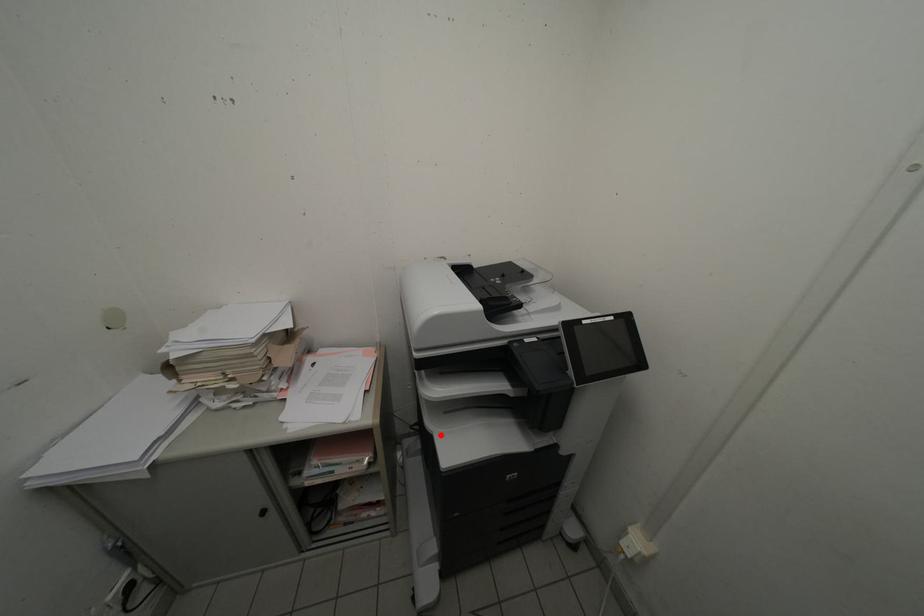
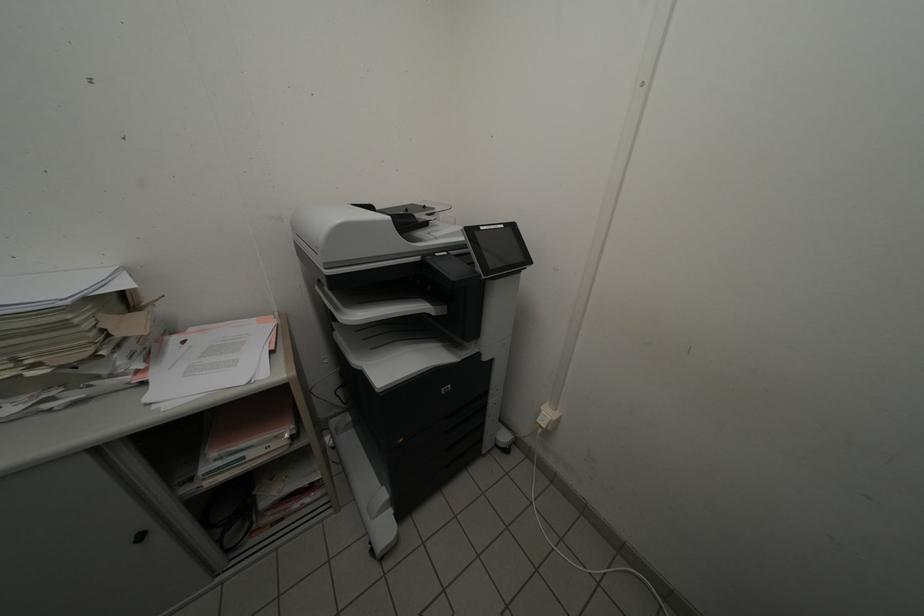
In the second image, find the point that corresponds to the highlighted location in the first image.

(370, 369)